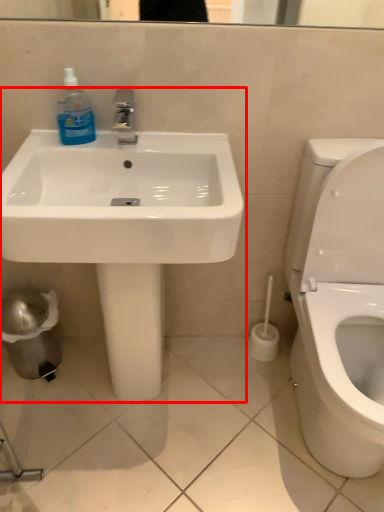
Question: From the image's perspective, where is sink (annotated by the red box) located relative to cleaning product?

Choices:
 (A) below
 (B) above

Answer: (A)